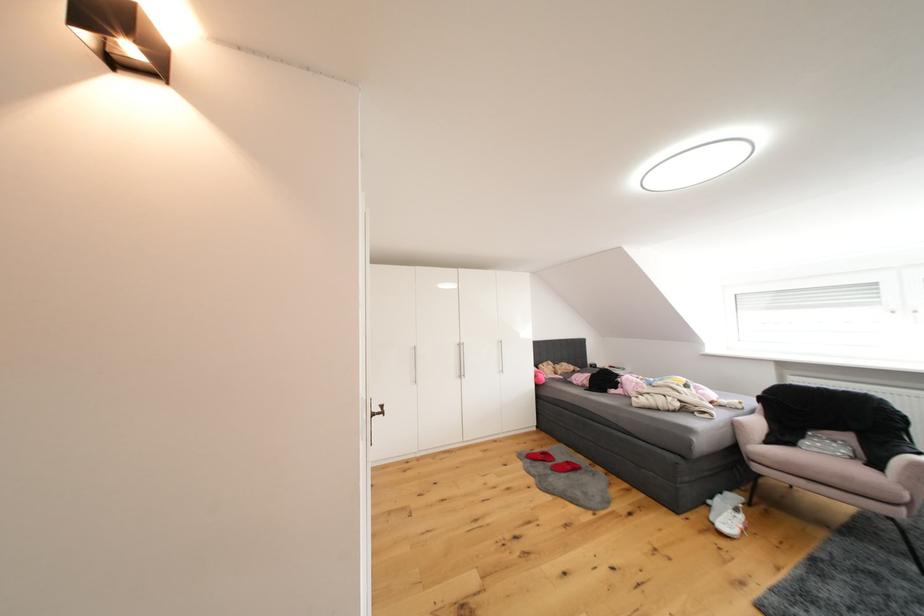
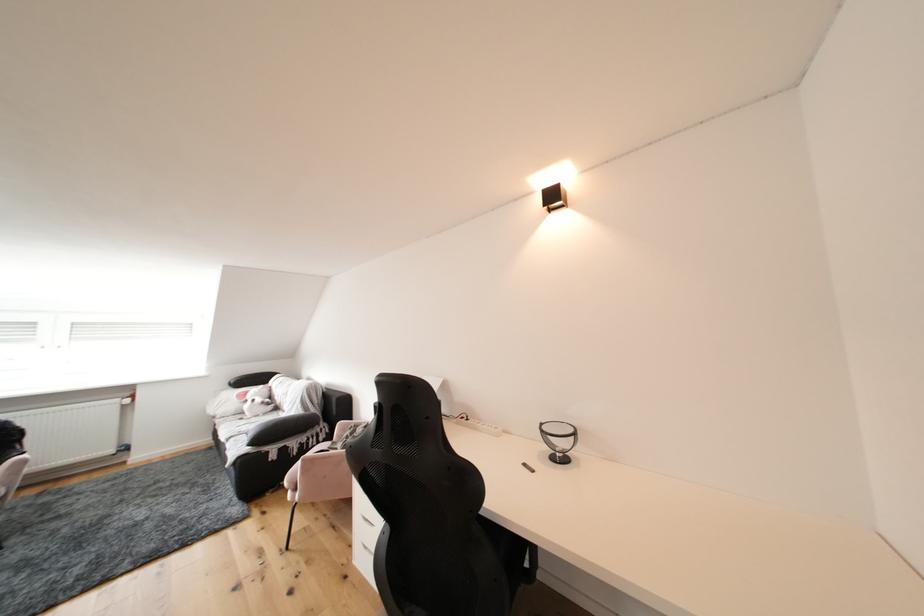
Question: The camera is either moving clockwise (left) or counter-clockwise (right) around the object. The first image is from the beginning of the video and the second image is from the end. Is the camera moving left or right when shooting the video?

Choices:
 (A) Left
 (B) Right

Answer: (A)